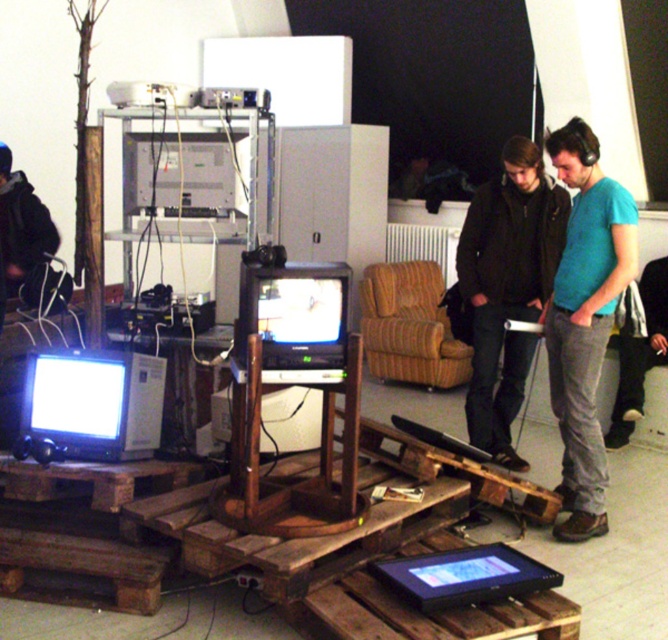
Does dark brown leather jacket at center appear on the right side of black leather jacket at lower left?

Correct, you'll find dark brown leather jacket at center to the right of black leather jacket at lower left.

Is dark brown leather jacket at center shorter than black leather jacket at lower left?

Incorrect, dark brown leather jacket at center's height does not fall short of black leather jacket at lower left's.

Image resolution: width=668 pixels, height=640 pixels. What are the coordinates of `dark brown leather jacket at center` in the screenshot? It's located at (506, 285).

Is point (574, 289) less distant than point (494, 572)?

That is False.

The width and height of the screenshot is (668, 640). What do you see at coordinates (584, 320) in the screenshot?
I see `teal t-shirt at center` at bounding box center [584, 320].

Where is `teal t-shirt at center`? The height and width of the screenshot is (640, 668). teal t-shirt at center is located at coordinates tap(584, 320).

The width and height of the screenshot is (668, 640). Describe the element at coordinates (94, 403) in the screenshot. I see `matte black monitor at lower left` at that location.

Is matte black monitor at lower left smaller than black leather jacket at lower left?

Yes, matte black monitor at lower left is smaller than black leather jacket at lower left.

What do you see at coordinates (94, 403) in the screenshot?
I see `matte black monitor at lower left` at bounding box center [94, 403].

This screenshot has width=668, height=640. Find the location of `matte black monitor at lower left`. matte black monitor at lower left is located at coordinates (94, 403).